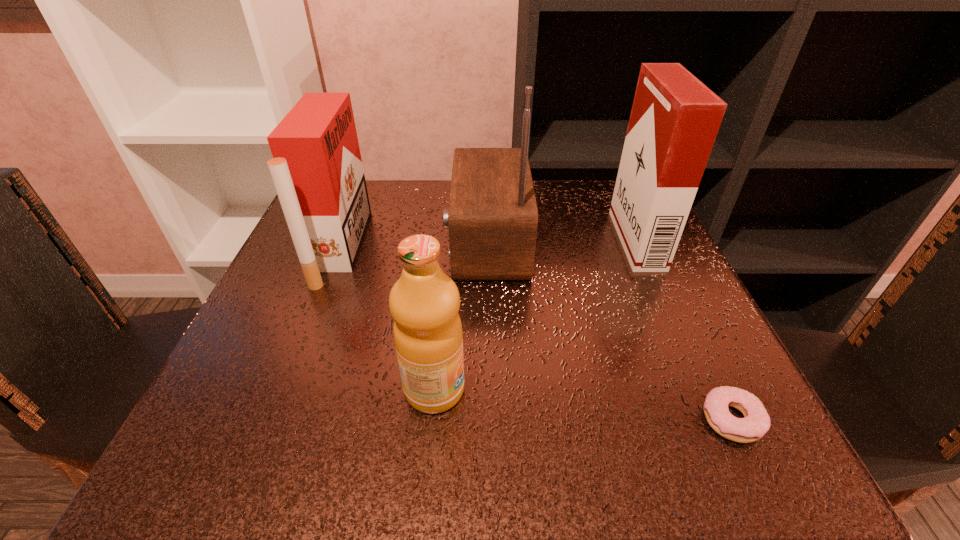
This screenshot has height=540, width=960. Find the location of `blank area in the image that satisfies the following two spatial constraints: 1. on the front-facing side of the doughnut; 2. on the left side of the radio receiver`. blank area in the image that satisfies the following two spatial constraints: 1. on the front-facing side of the doughnut; 2. on the left side of the radio receiver is located at coordinates (491, 419).

The image size is (960, 540). Identify the location of vacant region that satisfies the following two spatial constraints: 1. on the front-facing side of the shortest object; 2. on the left side of the taller cigarette case. (717, 419).

Image resolution: width=960 pixels, height=540 pixels. I want to click on vacant space that satisfies the following two spatial constraints: 1. on the front-facing side of the shorter cigarette case; 2. on the right side of the doughnut, so click(x=274, y=419).